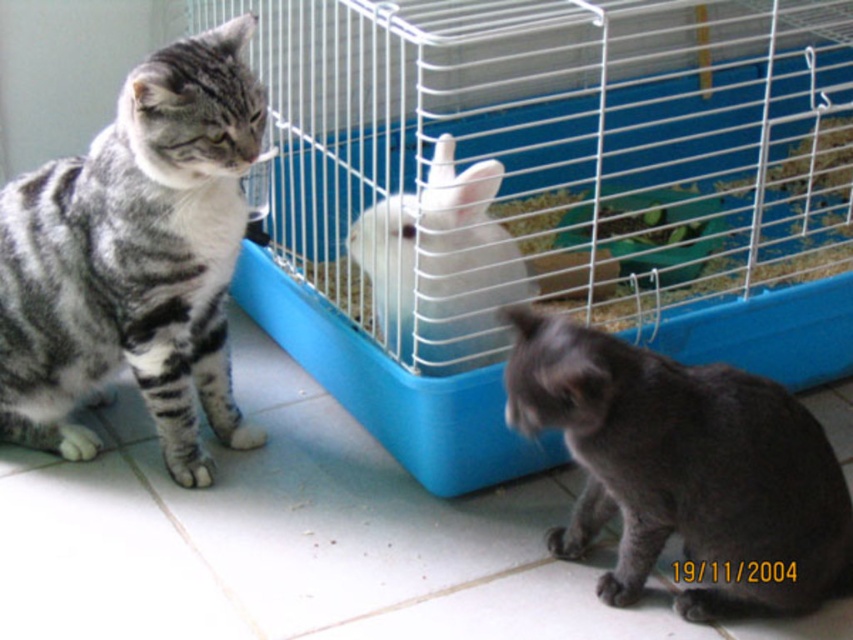
Question: Is gray striped fur cat at left positioned at the back of dark gray fur cat at lower right?

Choices:
 (A) no
 (B) yes

Answer: (B)

Question: Which point is closer to the camera taking this photo?

Choices:
 (A) (730, 312)
 (B) (740, 609)
 (C) (213, 86)

Answer: (C)

Question: Which of the following is the closest to the observer?

Choices:
 (A) white fluffy bunny at center
 (B) white wire bird cage at center

Answer: (B)

Question: Which point is farther to the camera?

Choices:
 (A) dark gray fur cat at lower right
 (B) gray striped fur cat at left
 (C) white wire bird cage at center

Answer: (B)

Question: Is white wire bird cage at center thinner than gray striped fur cat at left?

Choices:
 (A) yes
 (B) no

Answer: (B)

Question: Is white wire bird cage at center wider than dark gray fur cat at lower right?

Choices:
 (A) yes
 (B) no

Answer: (A)